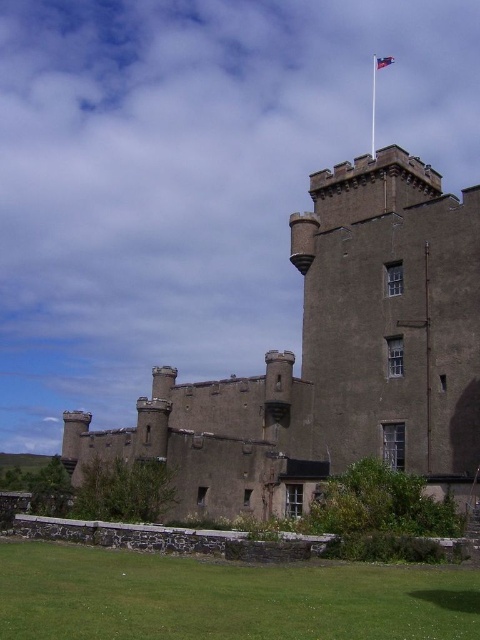
You are a tourist standing in front of the brown stone castle at center and looking towards the blue fabric flag at upper center. Is the flag above or below the castle?

The blue fabric flag at upper center is above the brown stone castle at center because it is positioned over it.